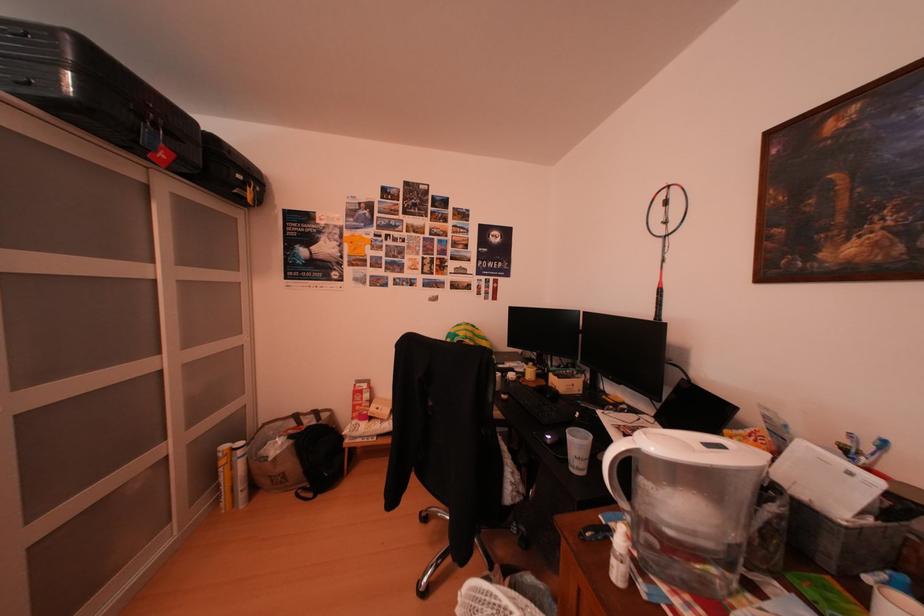
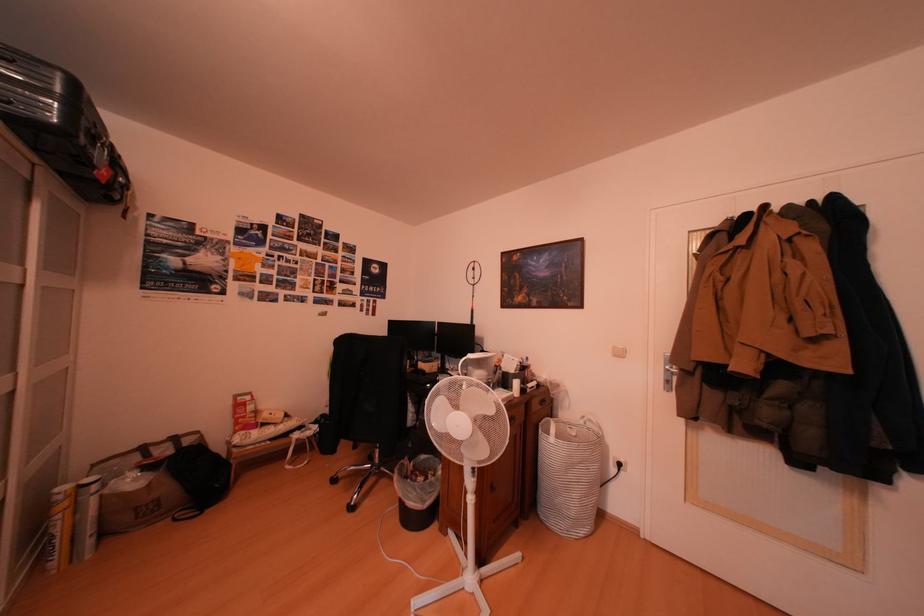
Locate, in the second image, the point that corresponds to [312,428] in the first image.

(161, 461)